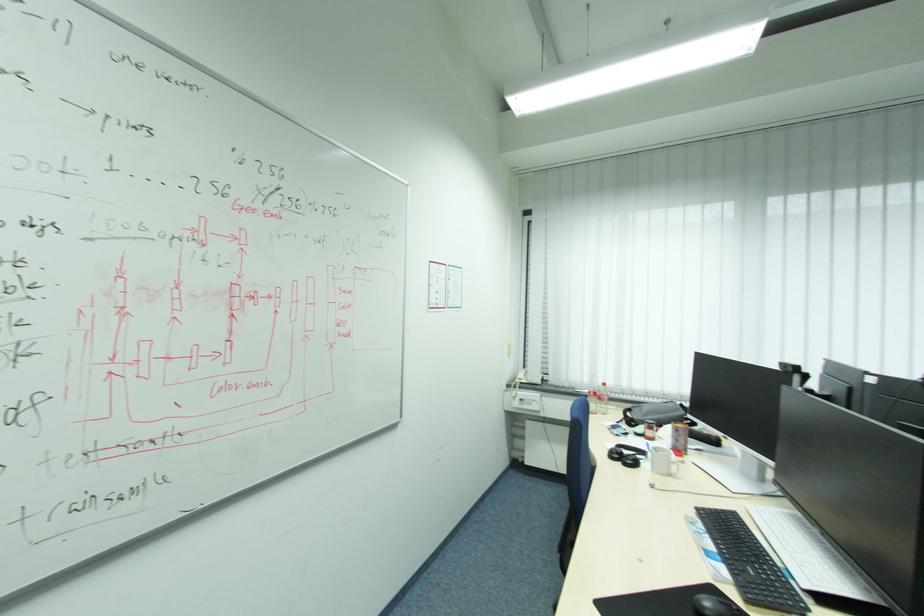
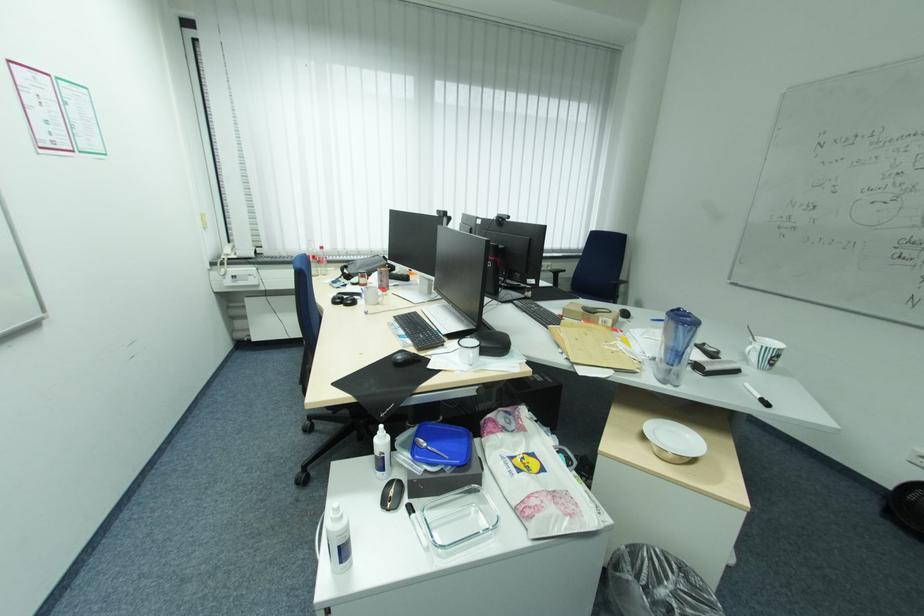
The point at (527, 379) is marked in the first image. Where is the corresponding point in the second image?

(234, 254)